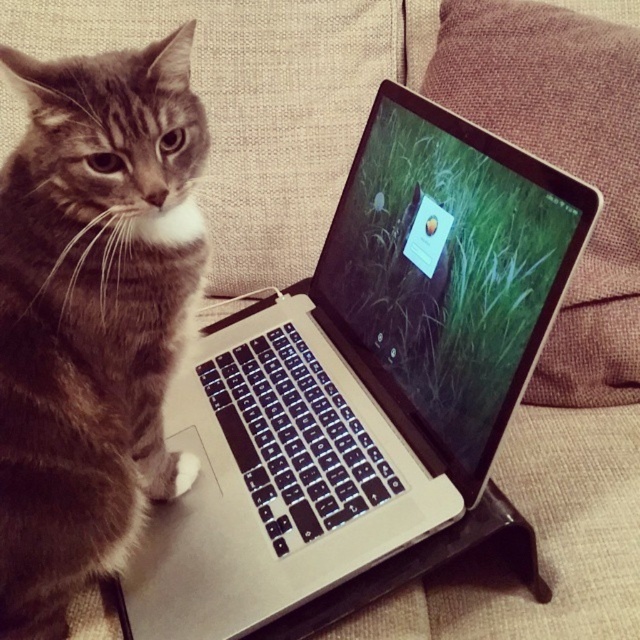
You are trying to place a rectangular box that is exactly the same width as the matte black screen at center onto the silver metallic laptop at center. Will the box fit horizontally without overlapping the edges?

The silver metallic laptop at center might be wider than matte black screen at center, so the box designed to match the matte black screen at center width may fit on the silver metallic laptop at center without overlapping the edges, but there is uncertainty due to the possibility of the laptop being wider.

You are a delivery robot that needs to place a small package on the silver metallic laptop at center. The package is 10 centimeters in height. Can you safely place the package on the laptop without it falling off?

The distance between the silver metallic laptop at center and the viewer is 56.87 centimeters. Since the package is only 10 centimeters tall, it can be safely placed on the laptop as the height difference won